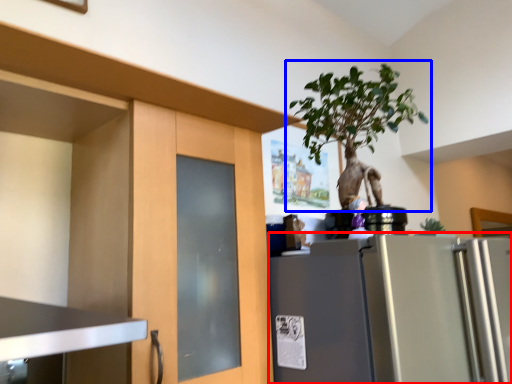
Question: Which object is closer to the camera taking this photo, refrigerator (highlighted by a red box) or houseplant (highlighted by a blue box)?

Choices:
 (A) refrigerator
 (B) houseplant

Answer: (A)